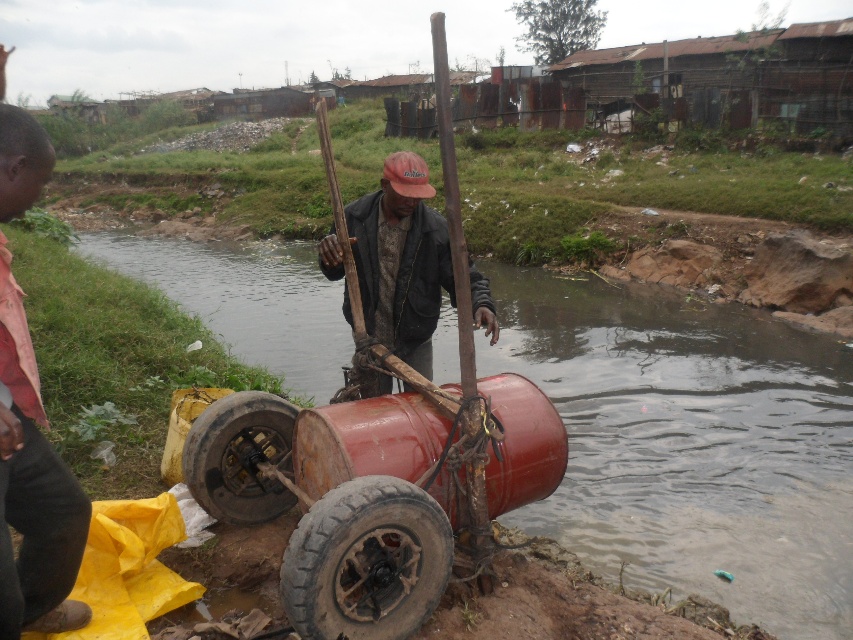
Question: Among these objects, which one is farthest from the camera?

Choices:
 (A) rusty metal wheel at center
 (B) rusty metallic river at center

Answer: (B)

Question: Which object is the farthest from the rusty metal wheel at center?

Choices:
 (A) matte black jacket at center
 (B) rusty metallic river at center
 (C) dirty rubber wheel at center

Answer: (B)

Question: Where is dirty rubber wheel at center located in relation to rusty metal wheel at center in the image?

Choices:
 (A) left
 (B) right

Answer: (B)

Question: Is rusty metallic river at center positioned in front of matte black jacket at center?

Choices:
 (A) no
 (B) yes

Answer: (A)

Question: Can you confirm if dirty rubber wheel at center is bigger than matte black jacket at center?

Choices:
 (A) no
 (B) yes

Answer: (A)

Question: Which point is farther from the camera taking this photo?

Choices:
 (A) (242, 468)
 (B) (320, 541)
 (C) (364, 396)

Answer: (A)